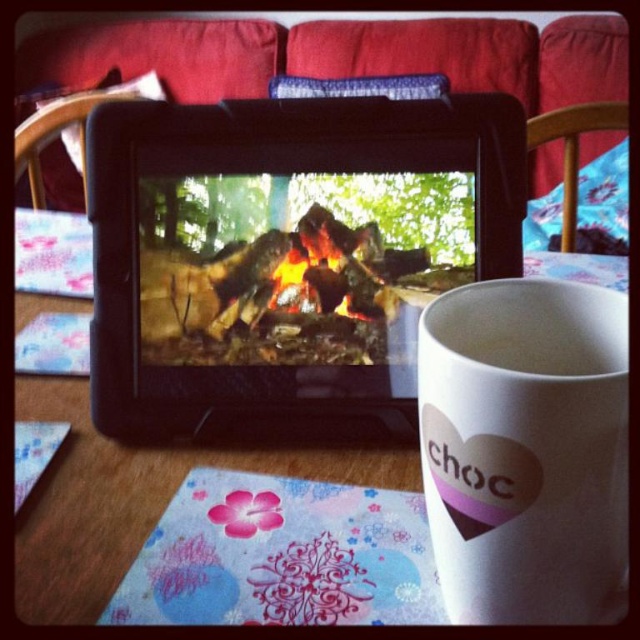
Where is the wooden table at center located in the image?

The wooden table at center is located at point (x=132, y=493).

Based on the photo, you are standing in the room and want to place a small sticker on the closest point between the two points, point [490,576] and point [376,307]. Which point should you choose?

Point [490,576] is closer to the viewer than point [376,307], so you should choose point [490,576] to place the sticker.